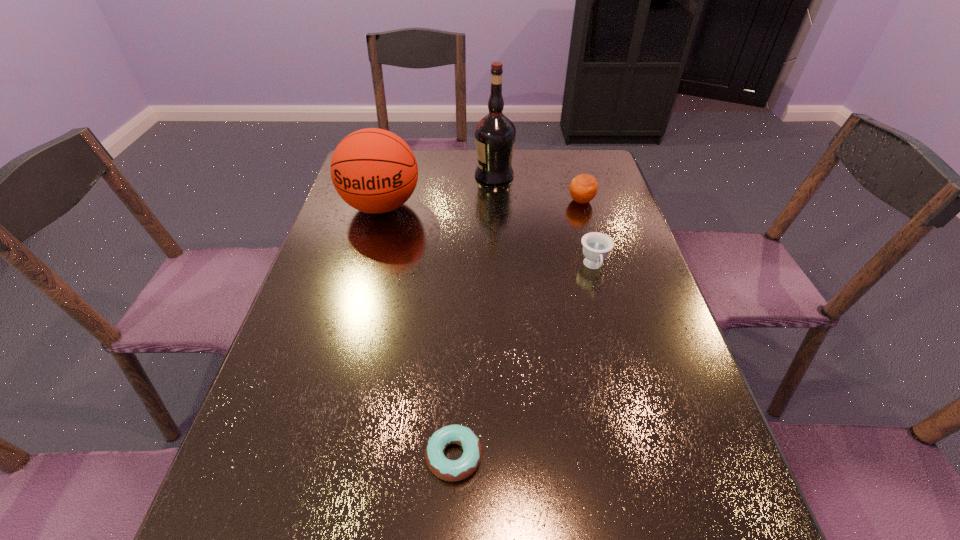
Find the location of a particular element. The height and width of the screenshot is (540, 960). vacant space that satisfies the following two spatial constraints: 1. on the back side of the nearest object; 2. on the left side of the third shortest object is located at coordinates (465, 201).